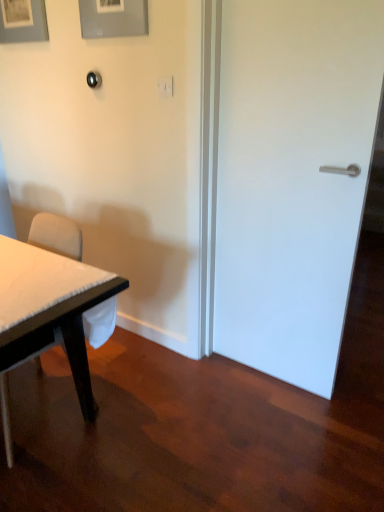
This screenshot has width=384, height=512. In order to click on free location to the right of white fabric chair at left in this screenshot , I will do `click(132, 412)`.